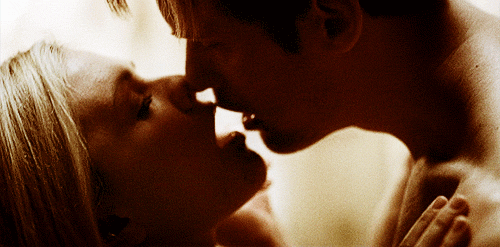
Identify the location of curtains. The width and height of the screenshot is (500, 247). (318, 209).